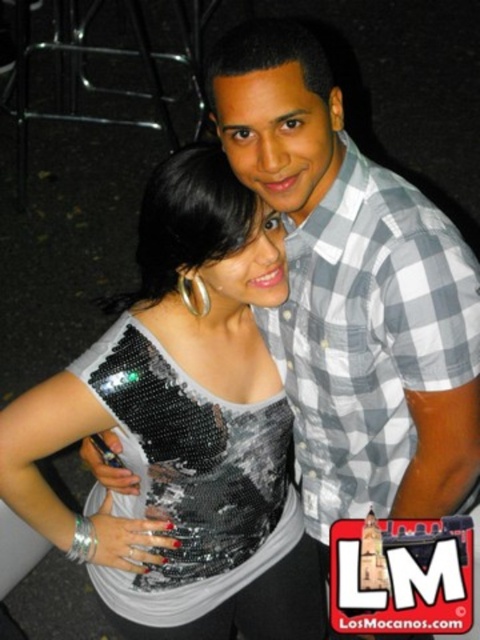
Question: Observing the image, what is the correct spatial positioning of sequined fabric top at center in reference to gray checkered shirt at upper right?

Choices:
 (A) below
 (B) above

Answer: (A)

Question: Is sequined fabric top at center smaller than gray checkered shirt at upper right?

Choices:
 (A) no
 (B) yes

Answer: (A)

Question: Based on their relative distances, which object is nearer to the sequined fabric top at center?

Choices:
 (A) sequined fabric dress at center
 (B) gray checkered shirt at upper right

Answer: (A)

Question: Which of the following is the farthest from the observer?

Choices:
 (A) click(x=277, y=330)
 (B) click(x=133, y=636)
 (C) click(x=204, y=410)

Answer: (B)

Question: Where is gray checkered shirt at upper right located in relation to sequined fabric dress at center in the image?

Choices:
 (A) left
 (B) right

Answer: (B)

Question: Which point is farther from the camera taking this photo?

Choices:
 (A) (422, 241)
 (B) (186, 536)
 (C) (50, 424)

Answer: (B)